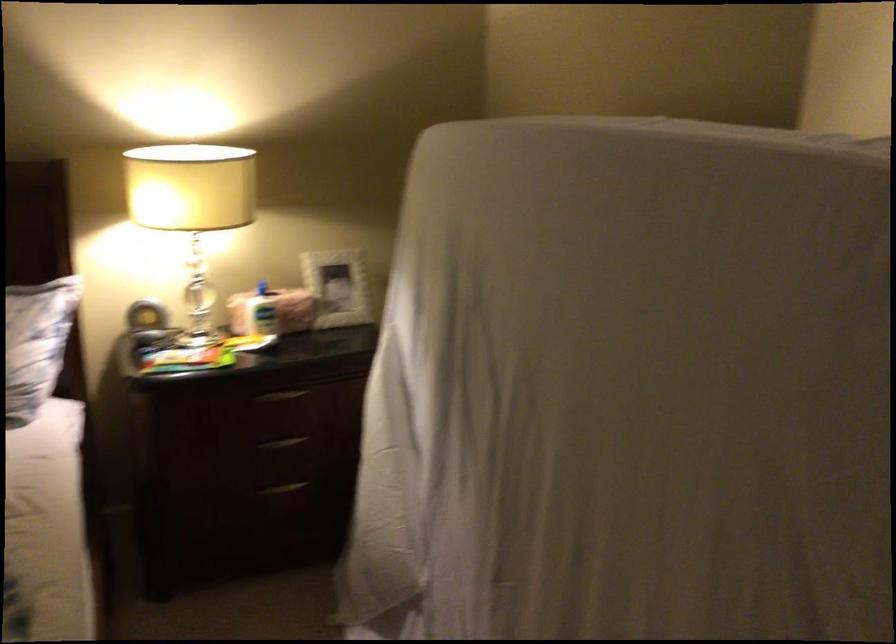
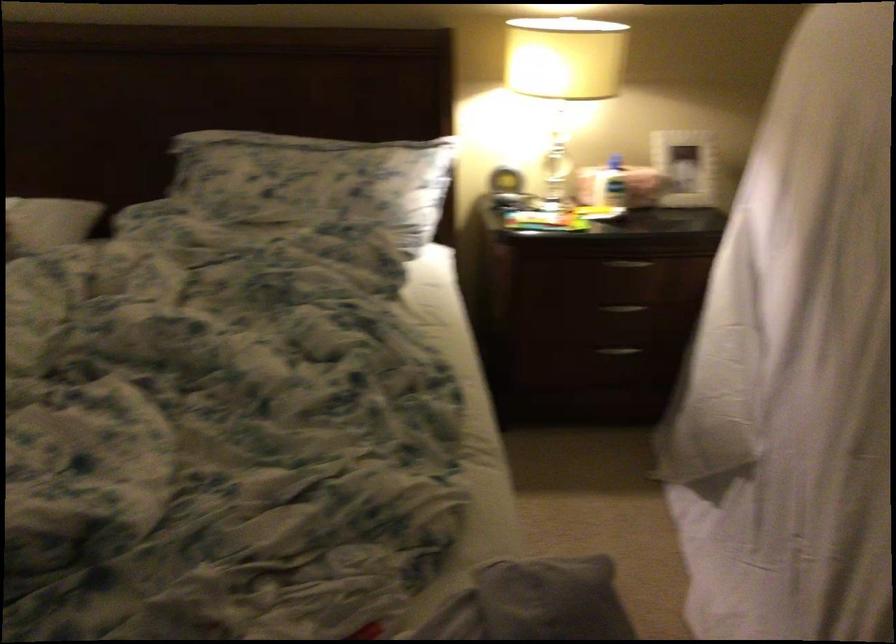
Where in the second image is the point corresponding to [280,401] from the first image?

(627, 263)